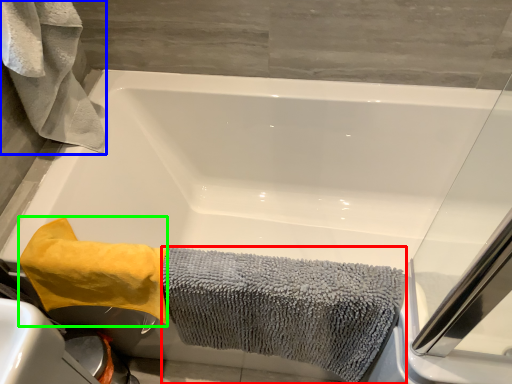
Question: Which object is positioned farthest from bath towel (highlighted by a red box)? Select from bath towel (highlighted by a blue box) and bath towel (highlighted by a green box).

Choices:
 (A) bath towel
 (B) bath towel

Answer: (A)